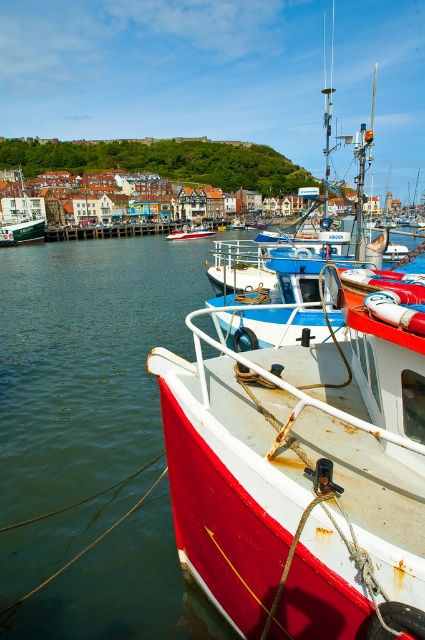
You are a delivery drone that needs to fly from the smooth wooden dock at center to the smooth water at center. What is the minimum distance you must cover to reach your destination?

The minimum distance you must cover to reach the smooth water at center from the smooth wooden dock at center is 169.11 feet.

You are standing on the pier and looking at two points marked in the harbor scene. The first point is at coordinates point [64,326] and the second is at point [124,236]. Which point is closer to you?

Point [64,326] is in front of point [124,236], so it is closer to you.